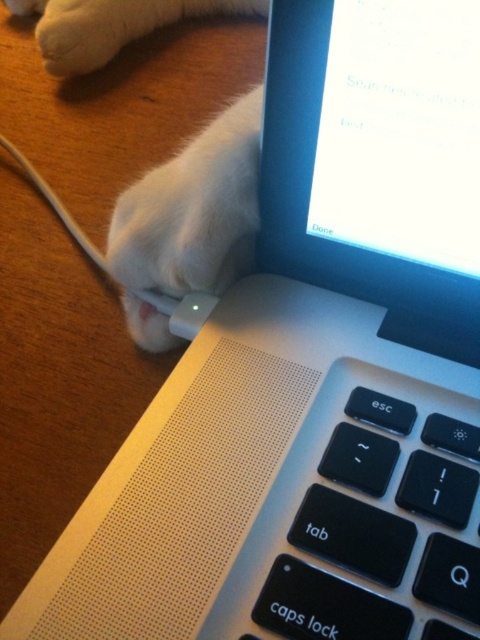
You are trying to reach the matte black screen at upper right from where you are standing. The minimum distance you can reach is 30 centimeters. Can you reach it?

The distance between you and the matte black screen at upper right is 31.91 centimeters, which is beyond your 30 centimeter reach. You cannot reach it.